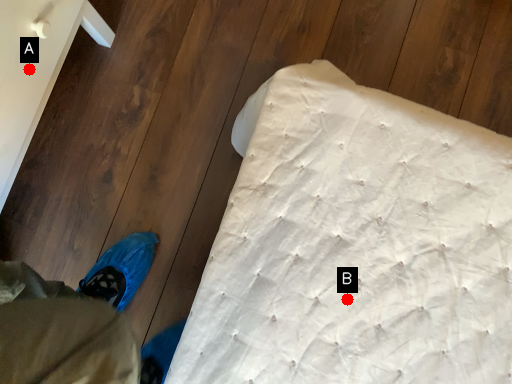
Question: Two points are circled on the image, labeled by A and B beside each circle. Which point is closer to the camera?

Choices:
 (A) A is closer
 (B) B is closer

Answer: (B)